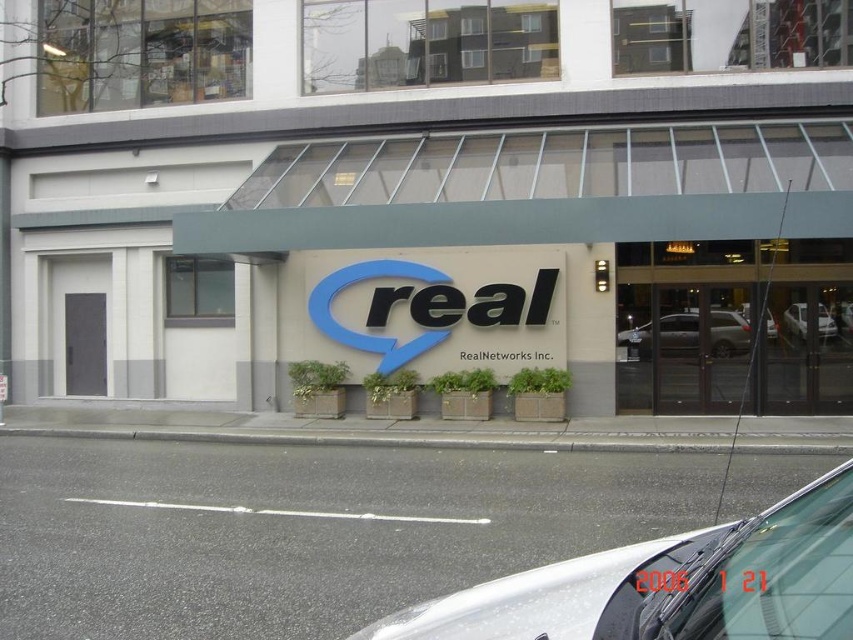
Is blue plastic sign at center bigger than silver metallic sedan at right?

Yes, blue plastic sign at center is bigger than silver metallic sedan at right.

Is blue plastic sign at center above silver metallic sedan at right?

Yes.

Does point (436, 344) lie behind point (804, 316)?

Yes, it is.

You are a GUI agent. You are given a task and a screenshot of the screen. Output one action in this format:
    pyautogui.click(x=<x>, y=<y>)
    Task: Click on the blue plastic sign at center
    This screenshot has height=640, width=853.
    Given the screenshot: What is the action you would take?
    pyautogui.click(x=434, y=312)

Which is more to the right, gray matte door at left or silver metallic sedan at right?

silver metallic sedan at right is more to the right.

Locate an element on the screen. This screenshot has width=853, height=640. gray matte door at left is located at coordinates (85, 342).

The width and height of the screenshot is (853, 640). Identify the location of gray matte door at left. (85, 342).

Can you confirm if silver metallic car at lower right is shorter than gray matte door at left?

Indeed, silver metallic car at lower right has a lesser height compared to gray matte door at left.

Can you confirm if silver metallic car at lower right is positioned to the left of gray matte door at left?

No, silver metallic car at lower right is not to the left of gray matte door at left.

Identify the location of silver metallic car at lower right. (672, 582).